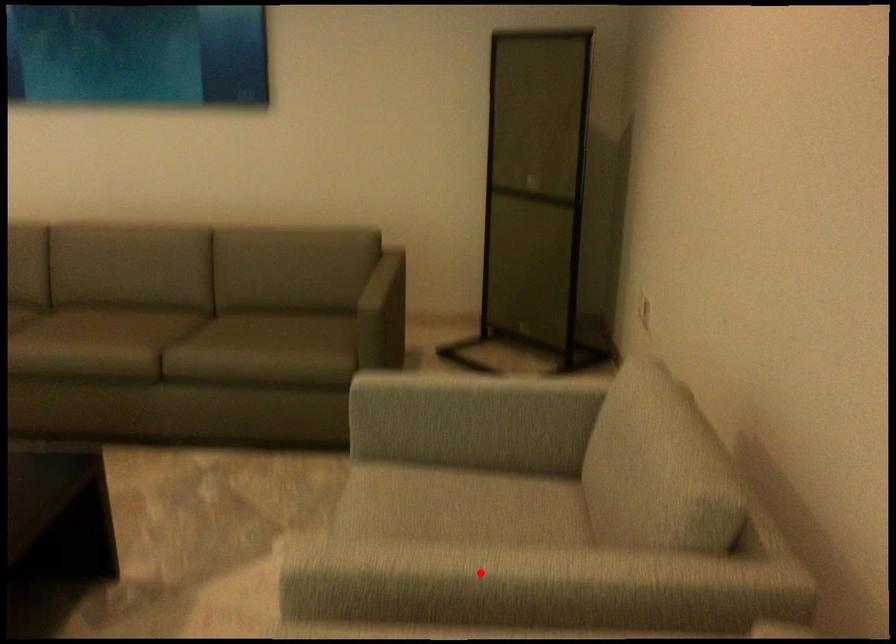
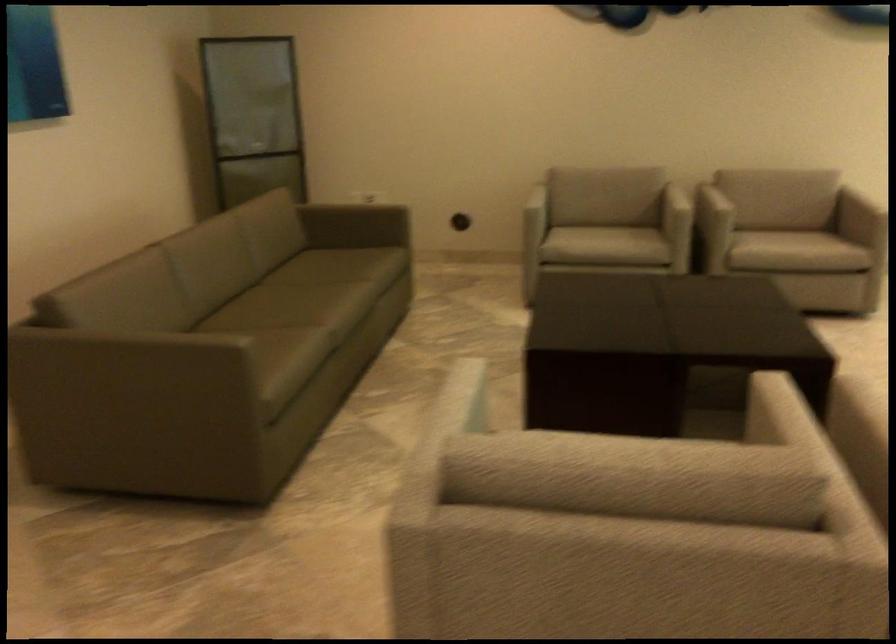
Locate, in the second image, the point that corresponds to the highlighted location in the first image.

(668, 190)